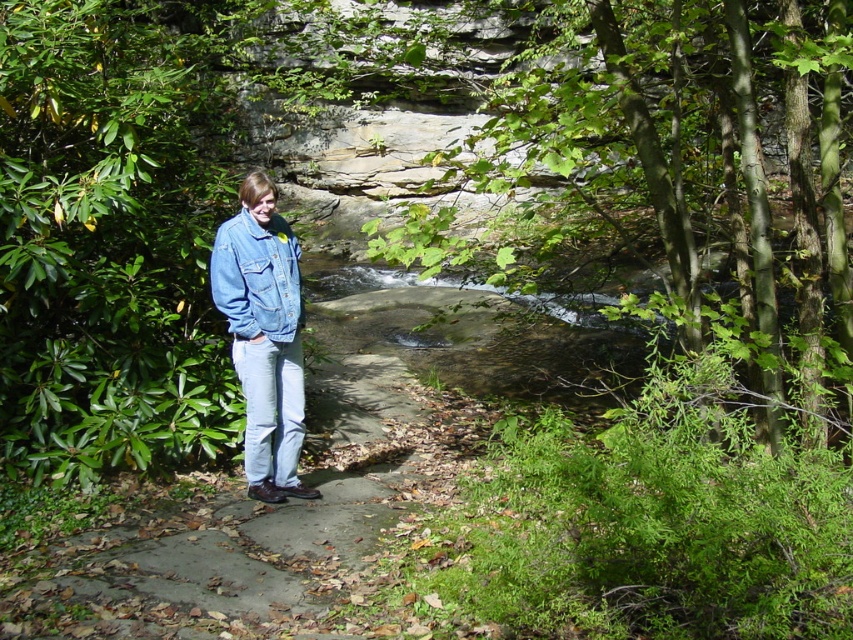
You are a photographer trying to capture the denim jacket at center and denim jacket at lower right in a single frame. Which denim jacket will appear wider in the photo?

The denim jacket at center will appear wider in the photo because its width surpasses that of the denim jacket at lower right.